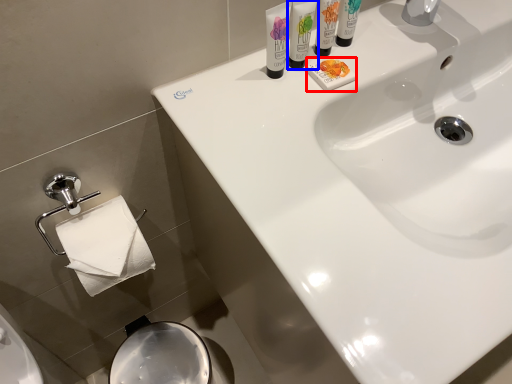
Question: Which point is further to the camera, soap (highlighted by a red box) or shaving cream (highlighted by a blue box)?

Choices:
 (A) soap
 (B) shaving cream

Answer: (A)